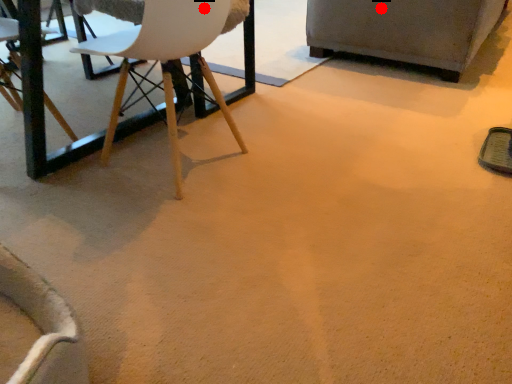
Question: Two points are circled on the image, labeled by A and B beside each circle. Which point is further to the camera?

Choices:
 (A) A is further
 (B) B is further

Answer: (A)